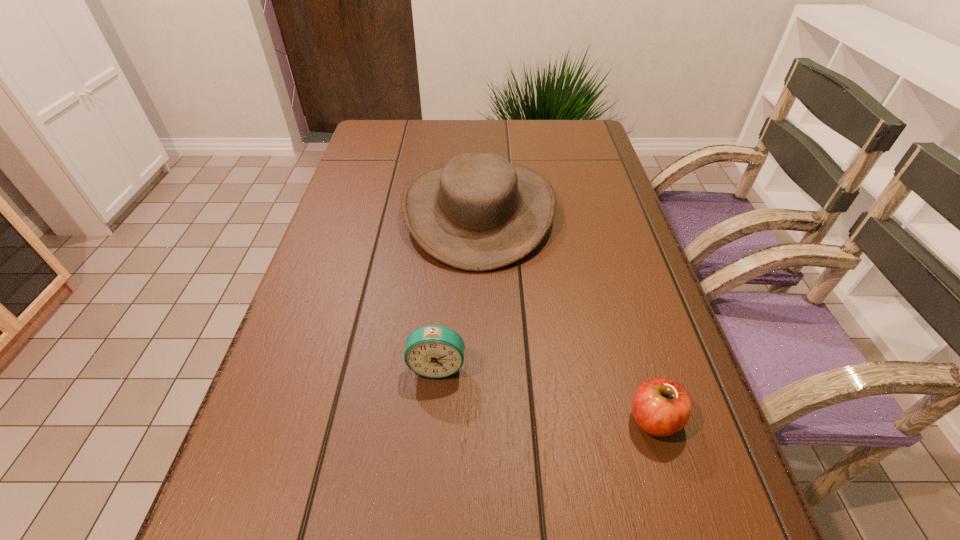
Find the location of a particular element. Image resolution: width=960 pixels, height=540 pixels. vacant region between the tallest object and the second shortest object is located at coordinates (458, 288).

Locate an element on the screen. This screenshot has width=960, height=540. blank region between the alarm clock and the tallest object is located at coordinates (458, 288).

Find the location of a particular element. object that is the closest one to the cowboy hat is located at coordinates (435, 351).

The width and height of the screenshot is (960, 540). I want to click on the second closest object relative to the alarm clock, so 661,407.

Locate an element on the screen. vacant space that satisfies the following two spatial constraints: 1. on the front-facing side of the second shortest object; 2. on the right side of the rightmost object is located at coordinates (433, 420).

The width and height of the screenshot is (960, 540). Find the location of `vacant area that satisfies the following two spatial constraints: 1. on the front-facing side of the second tallest object; 2. on the left side of the nearest object`. vacant area that satisfies the following two spatial constraints: 1. on the front-facing side of the second tallest object; 2. on the left side of the nearest object is located at coordinates (433, 420).

You are a GUI agent. You are given a task and a screenshot of the screen. Output one action in this format:
    pyautogui.click(x=<x>, y=<y>)
    Task: Click on the free location that satisfies the following two spatial constraints: 1. on the front-facing side of the second shortest object; 2. on the right side of the apple
    
    Given the screenshot: What is the action you would take?
    pyautogui.click(x=433, y=420)